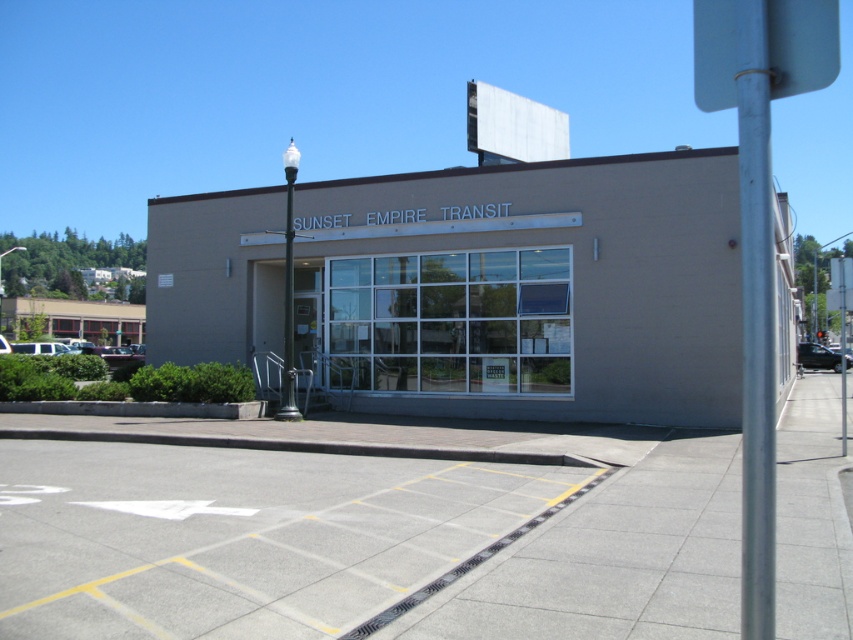
Which is in front, point (747, 324) or point (746, 417)?

Point (747, 324) is in front.

Does metallic silver sign at upper right have a lesser width compared to silver metallic pole at right?

Incorrect, metallic silver sign at upper right's width is not less than silver metallic pole at right's.

Is point (762, 230) in front of point (741, 35)?

Yes, point (762, 230) is in front of point (741, 35).

At what (x,y) coordinates should I click in order to perform the action: click on metallic silver sign at upper right. Please return your answer as a coordinate pair (x, y). Looking at the image, I should click on (759, 227).

The height and width of the screenshot is (640, 853). In order to click on beige concrete building at center in this screenshot , I will do `click(531, 289)`.

Does beige concrete building at center lie behind silver metallic pole at right?

Yes, it is behind silver metallic pole at right.

Consider the image. Who is more distant from viewer, (607, 410) or (750, 227)?

The point (607, 410) is behind.

Locate an element on the screen. beige concrete building at center is located at coordinates (531, 289).

How far apart are beige concrete building at center and metallic silver sign at upper right?

The distance of beige concrete building at center from metallic silver sign at upper right is 7.16 meters.

Is point (581, 298) closer to camera compared to point (715, 35)?

No, (581, 298) is behind (715, 35).

Measure the distance between point [426,205] and camera.

Point [426,205] and camera are 17.62 meters apart.

Find the location of a particular element. This screenshot has width=853, height=640. beige concrete building at center is located at coordinates (531, 289).